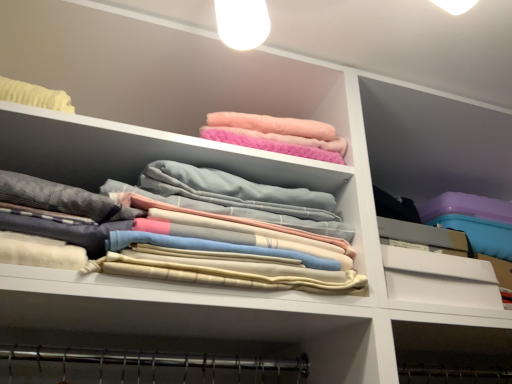
Question: Can you confirm if soft pastel fabric at center is bigger than white matte drawer at right?

Choices:
 (A) yes
 (B) no

Answer: (A)

Question: Is the depth of soft pastel fabric at center less than that of white matte drawer at right?

Choices:
 (A) no
 (B) yes

Answer: (B)

Question: Can you confirm if soft pastel fabric at center is shorter than white matte drawer at right?

Choices:
 (A) yes
 (B) no

Answer: (B)

Question: From the image's perspective, does soft pastel fabric at center appear lower than white matte drawer at right?

Choices:
 (A) no
 (B) yes

Answer: (A)

Question: From the image's perspective, is soft pastel fabric at center on white matte drawer at right?

Choices:
 (A) no
 (B) yes

Answer: (B)

Question: Does soft pastel fabric at center appear on the right side of white matte drawer at right?

Choices:
 (A) no
 (B) yes

Answer: (A)

Question: Is white matte drawer at right at the right side of soft pastel fabric at center?

Choices:
 (A) no
 (B) yes

Answer: (B)

Question: Is the surface of white matte drawer at right in direct contact with soft pastel fabric at center?

Choices:
 (A) no
 (B) yes

Answer: (A)

Question: Does white matte drawer at right have a lesser height compared to soft pastel fabric at center?

Choices:
 (A) no
 (B) yes

Answer: (B)

Question: From the image's perspective, is white matte drawer at right beneath soft pastel fabric at center?

Choices:
 (A) yes
 (B) no

Answer: (A)

Question: Is white matte drawer at right surrounding soft pastel fabric at center?

Choices:
 (A) yes
 (B) no

Answer: (B)

Question: Is white matte drawer at right positioned with its back to soft pastel fabric at center?

Choices:
 (A) no
 (B) yes

Answer: (A)

Question: Is soft pastel fabric at center bigger or smaller than white matte drawer at right?

Choices:
 (A) small
 (B) big

Answer: (B)